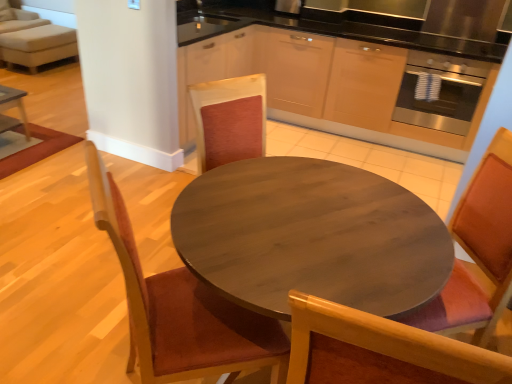
Question: From the image's perspective, relative to wooden chair at left, placed as the second chair when sorted from right to left, is wooden table at center above or below?

Choices:
 (A) above
 (B) below

Answer: (B)

Question: In terms of size, does wooden table at center appear bigger or smaller than wooden chair at left, placed as the second chair when sorted from right to left?

Choices:
 (A) small
 (B) big

Answer: (B)

Question: Which of these objects is positioned closest to the wooden table at center?

Choices:
 (A) light beige fabric couch at upper left
 (B) wooden chair at left, the 1th chair viewed from the left
 (C) stainless steel oven at right
 (D) wooden chair at center, the 2th chair from the left

Answer: (B)

Question: Based on their relative distances, which object is nearer to the light beige fabric couch at upper left?

Choices:
 (A) wooden chair at left, placed as the second chair when sorted from right to left
 (B) wooden table at center
 (C) stainless steel oven at right
 (D) wooden chair at center, the 1th chair viewed from the right

Answer: (C)